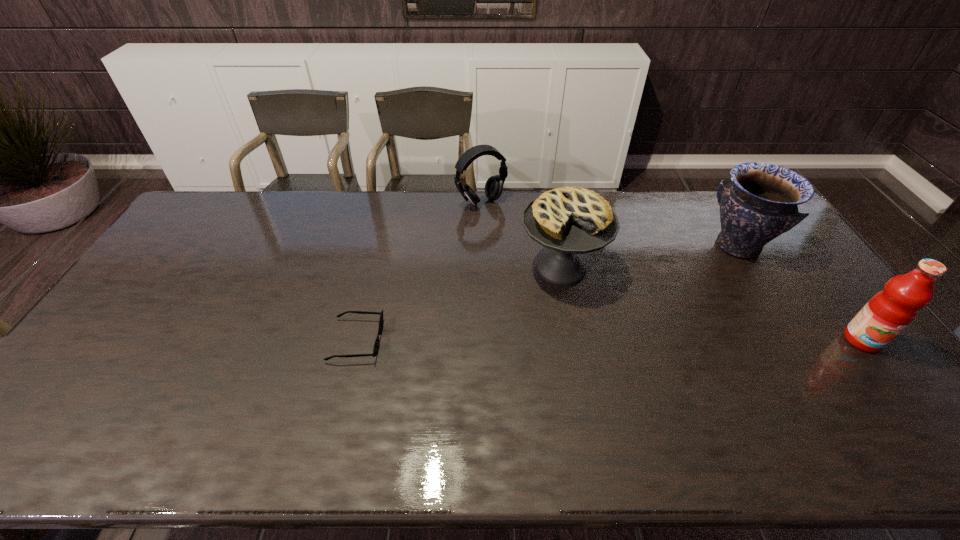
Where is `vacant region located 0.210m on the ear cups of the earphone`? The height and width of the screenshot is (540, 960). vacant region located 0.210m on the ear cups of the earphone is located at coordinates (524, 245).

At what (x,y) coordinates should I click in order to perform the action: click on vacant region located 0.140m on the ear cups of the earphone. Please return your answer as a coordinate pair (x, y). Looking at the image, I should click on (514, 233).

The width and height of the screenshot is (960, 540). I want to click on vacant position located on the front handle of the pottery, so click(709, 281).

You are a GUI agent. You are given a task and a screenshot of the screen. Output one action in this format:
    pyautogui.click(x=<x>, y=<y>)
    Task: Click on the vacant space located on the front handle of the pottery
    
    Given the screenshot: What is the action you would take?
    pyautogui.click(x=706, y=286)

The width and height of the screenshot is (960, 540). What are the coordinates of `free location located on the front handle of the pottery` in the screenshot? It's located at (670, 329).

Where is `free point located on the cut side of the third object from left to right`? The image size is (960, 540). free point located on the cut side of the third object from left to right is located at coordinates (543, 363).

Locate an element on the screen. vacant space positioned on the cut side of the third object from left to right is located at coordinates (537, 400).

Find the location of a particular element. This screenshot has height=540, width=960. vacant space located 0.050m on the cut side of the third object from left to right is located at coordinates (553, 312).

I want to click on earphone located at the far edge, so click(x=494, y=185).

What are the coordinates of `pottery positioned at the far edge` in the screenshot? It's located at (762, 202).